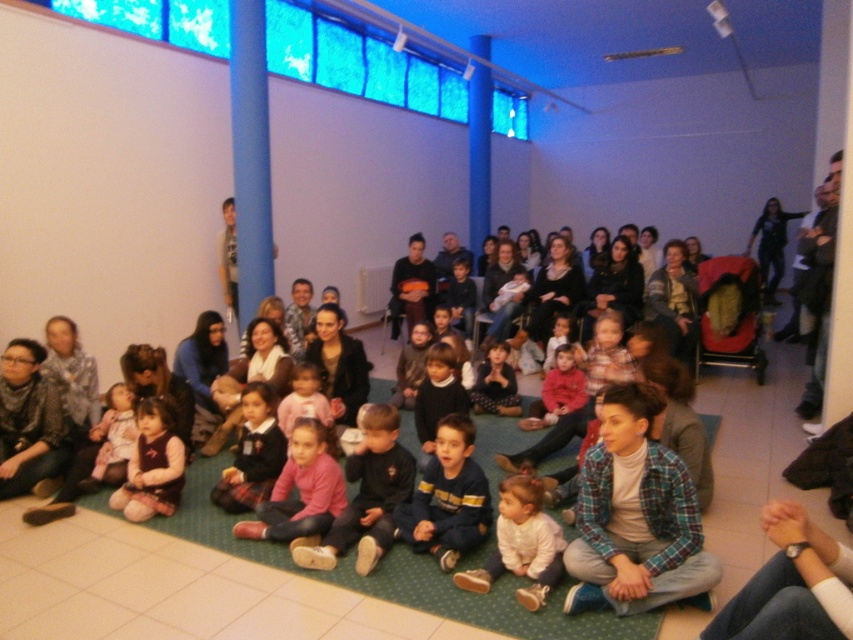
You are a photographer standing in the back of the room. You need to take a photo of both the plaid fabric shirt at center and the matte red sweater at center. Which one will be more visible in the photo?

The plaid fabric shirt at center will be more visible in the photo because it is much taller than the matte red sweater at center, making it stand out more in the frame.

In the scene shown: You are standing at the entrance of the room and see the plaid fabric shirt at center. If you walk straight towards it, will you reach it before reaching the blue vertical columns along the back wall?

The plaid fabric shirt at center is located at point (x=637, y=512). Since the columns are along the back wall, the shirt is closer to the entrance than the columns. Therefore, you will reach the plaid fabric shirt at center before the columns.

You are a photographer setting up for a group photo. You need to ensure that the pink matte shirt at center and the velvet maroon dress at lower left are both visible in the frame. Considering their sizes, which one might require more space in the composition?

The pink matte shirt at center is bigger than the velvet maroon dress at lower left, so it would require more space in the composition to ensure it is fully visible.